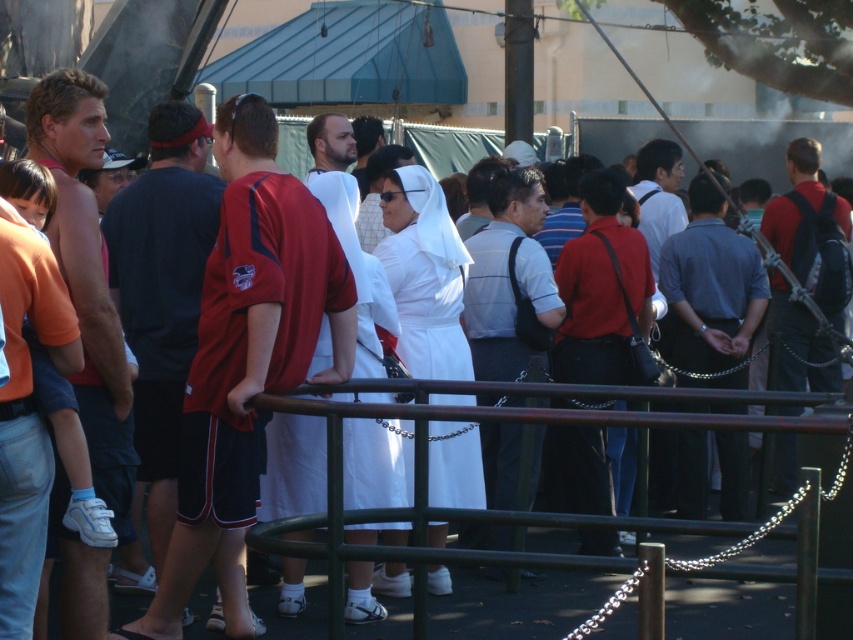
You are a security guard at the event. You need to ensure that the green metal railing at center is tall enough to prevent the matte black backpack at right from being thrown over it. Is the railing tall enough based on the scene?

The green metal railing at center has a lesser height compared to matte black backpack at right, so the railing is not tall enough to prevent the backpack from being thrown over it.

You are standing at the entrance of an event and see a person wearing a dark gray shirt at center. Can you tell me the exact coordinates where this person is located?

The dark gray shirt at center is located at point [508,275].